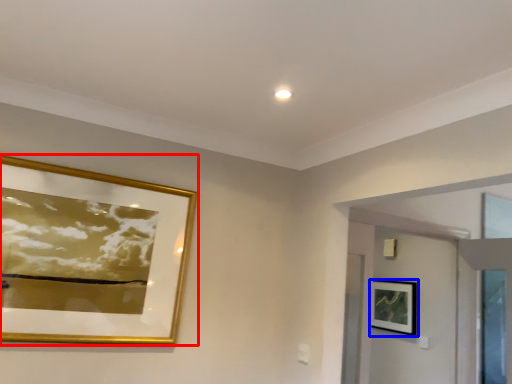
Question: Which of the following is the closest to the observer, picture frame (highlighted by a red box) or picture frame (highlighted by a blue box)?

Choices:
 (A) picture frame
 (B) picture frame

Answer: (A)